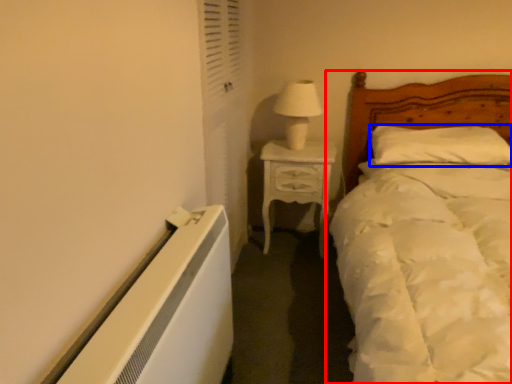
Question: Among these objects, which one is farthest to the camera, bed (highlighted by a red box) or pillow (highlighted by a blue box)?

Choices:
 (A) bed
 (B) pillow

Answer: (B)